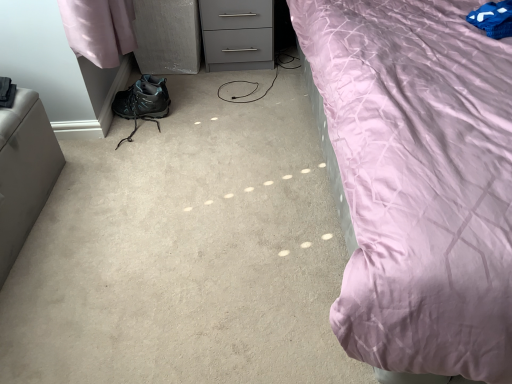
Question: Does satin gray ottoman at left appear on the right side of matte black hiking boot at lower left?

Choices:
 (A) yes
 (B) no

Answer: (B)

Question: Is satin gray ottoman at left positioned with its back to matte black hiking boot at lower left?

Choices:
 (A) no
 (B) yes

Answer: (A)

Question: Could you tell me if satin gray ottoman at left is turned towards matte black hiking boot at lower left?

Choices:
 (A) yes
 (B) no

Answer: (B)

Question: Is matte black hiking boot at lower left surrounded by satin gray ottoman at left?

Choices:
 (A) yes
 (B) no

Answer: (B)

Question: Are satin gray ottoman at left and matte black hiking boot at lower left far apart?

Choices:
 (A) yes
 (B) no

Answer: (B)

Question: From the image's perspective, is matte pink fabric at upper right located above or below gray matte chest of drawers at upper center?

Choices:
 (A) below
 (B) above

Answer: (A)

Question: Looking at their shapes, would you say matte pink fabric at upper right is wider or thinner than gray matte chest of drawers at upper center?

Choices:
 (A) thin
 (B) wide

Answer: (B)

Question: Is matte pink fabric at upper right taller or shorter than gray matte chest of drawers at upper center?

Choices:
 (A) tall
 (B) short

Answer: (A)

Question: From a real-world perspective, is matte pink fabric at upper right positioned above or below gray matte chest of drawers at upper center?

Choices:
 (A) above
 (B) below

Answer: (A)

Question: Considering the positions of gray matte chest of drawers at upper center and matte black hiking boot at lower left in the image, is gray matte chest of drawers at upper center wider or thinner than matte black hiking boot at lower left?

Choices:
 (A) wide
 (B) thin

Answer: (A)

Question: Which is correct: gray matte chest of drawers at upper center is inside matte black hiking boot at lower left, or outside of it?

Choices:
 (A) inside
 (B) outside

Answer: (B)

Question: From a real-world perspective, is gray matte chest of drawers at upper center physically located above or below matte black hiking boot at lower left?

Choices:
 (A) below
 (B) above

Answer: (B)

Question: Is point (270, 16) closer or farther from the camera than point (140, 105)?

Choices:
 (A) closer
 (B) farther

Answer: (B)

Question: Would you say gray matte chest of drawers at upper center is inside or outside blue fabric pillow at upper right?

Choices:
 (A) inside
 (B) outside

Answer: (B)

Question: From their relative heights in the image, would you say gray matte chest of drawers at upper center is taller or shorter than blue fabric pillow at upper right?

Choices:
 (A) short
 (B) tall

Answer: (B)